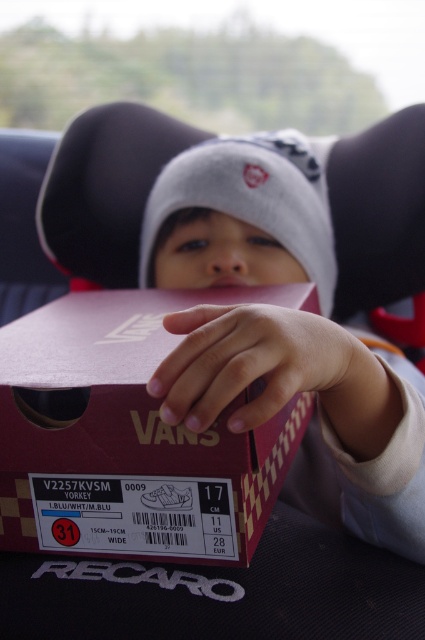
Does matte gray beanie at center appear on the left side of matte red shoebox at center?

Incorrect, matte gray beanie at center is not on the left side of matte red shoebox at center.

Does point (367, 145) come closer to viewer compared to point (141, 385)?

No, it is behind (141, 385).

In order to click on matte gray beanie at center in this screenshot , I will do `click(297, 212)`.

Find the location of a particular element. matte gray beanie at center is located at coordinates (297, 212).